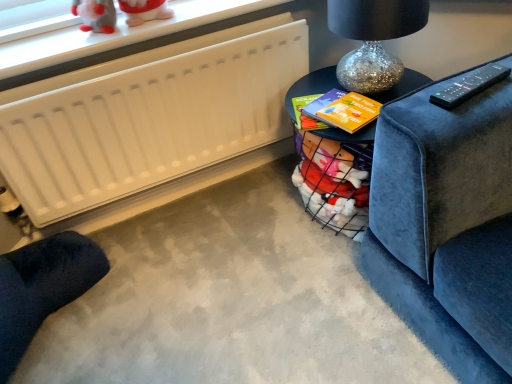
Question: Does black glossy table at center, the first table in the front-to-back sequence, contain white matte radiator at upper left?

Choices:
 (A) no
 (B) yes

Answer: (A)

Question: Can you confirm if black glossy table at center, arranged as the 2th table when viewed from the back, is smaller than white matte radiator at upper left?

Choices:
 (A) no
 (B) yes

Answer: (A)

Question: Is black glossy table at center, the first table in the front-to-back sequence, located outside white matte radiator at upper left?

Choices:
 (A) no
 (B) yes

Answer: (B)

Question: Is black glossy table at center, arranged as the 2th table when viewed from the back, with white matte radiator at upper left?

Choices:
 (A) no
 (B) yes

Answer: (A)

Question: Is black glossy table at center, the first table in the front-to-back sequence, behind white matte radiator at upper left?

Choices:
 (A) no
 (B) yes

Answer: (A)

Question: From the image's perspective, is white matte radiator at upper left located above or below dark blue fabric footrest at lower left?

Choices:
 (A) above
 (B) below

Answer: (A)

Question: Would you say white matte radiator at upper left is to the left or to the right of dark blue fabric footrest at lower left in the picture?

Choices:
 (A) left
 (B) right

Answer: (B)

Question: From a real-world perspective, is white matte radiator at upper left positioned above or below dark blue fabric footrest at lower left?

Choices:
 (A) below
 (B) above

Answer: (B)

Question: Based on their sizes in the image, would you say white matte radiator at upper left is bigger or smaller than dark blue fabric footrest at lower left?

Choices:
 (A) big
 (B) small

Answer: (B)

Question: Is point (78, 82) positioned closer to the camera than point (309, 89)?

Choices:
 (A) closer
 (B) farther

Answer: (A)

Question: From the image's perspective, is white matte radiator at upper left above or below matte black table at upper right, which is the second table from front to back?

Choices:
 (A) below
 (B) above

Answer: (B)

Question: From a real-world perspective, is white matte radiator at upper left physically located above or below matte black table at upper right, which is the second table from front to back?

Choices:
 (A) above
 (B) below

Answer: (B)

Question: Is white matte radiator at upper left situated inside matte black table at upper right, which is the first table from back to front, or outside?

Choices:
 (A) inside
 (B) outside

Answer: (B)

Question: Is sparkly glass table lamp at upper right inside the boundaries of matte black table at upper right, which is the second table from front to back, or outside?

Choices:
 (A) inside
 (B) outside

Answer: (B)

Question: From the image's perspective, is sparkly glass table lamp at upper right positioned above or below matte black table at upper right, which is the first table from back to front?

Choices:
 (A) above
 (B) below

Answer: (A)